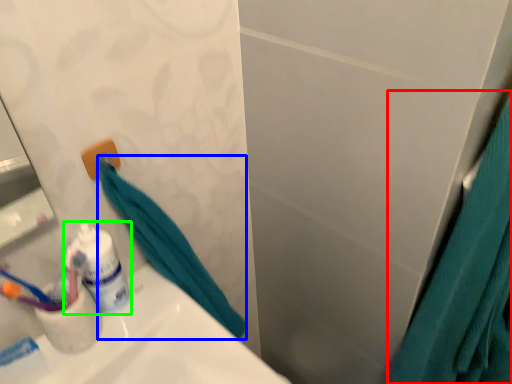
Question: Considering the real-world distances, which object is farthest from shower curtain (highlighted by a red box)? bath towel (highlighted by a blue box) or toiletry (highlighted by a green box)?

Choices:
 (A) bath towel
 (B) toiletry

Answer: (B)